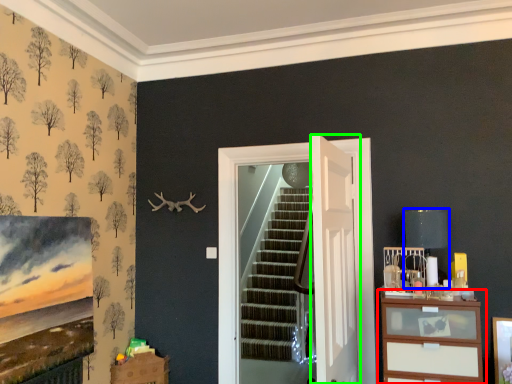
Question: Which is farther away from chest of drawers (highlighted by a red box)? lamp (highlighted by a blue box) or door (highlighted by a green box)?

Choices:
 (A) lamp
 (B) door

Answer: (A)